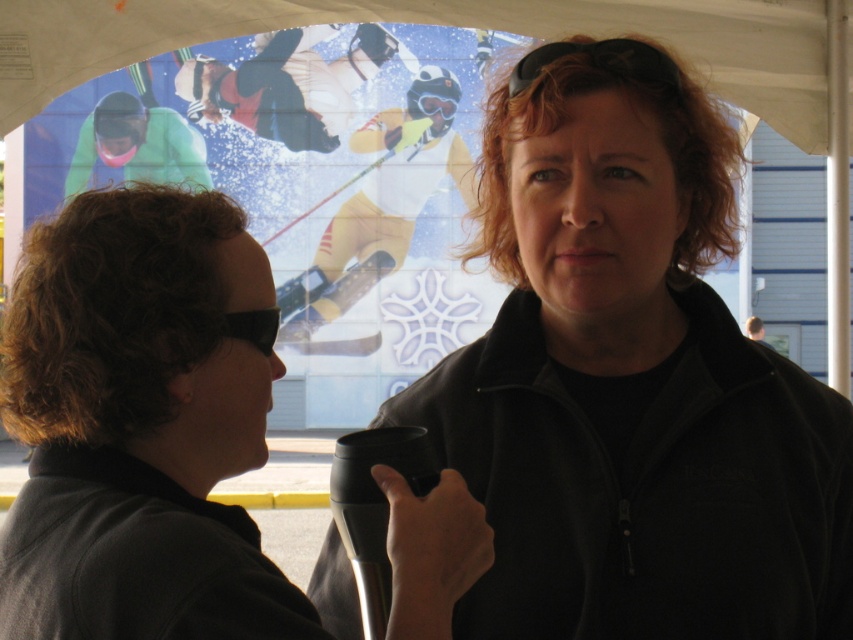
Question: Is black matte jacket at center positioned in front of green fabric jacket at upper left?

Choices:
 (A) yes
 (B) no

Answer: (A)

Question: Among these points, which one is nearest to the camera?

Choices:
 (A) (473, 182)
 (B) (149, 108)
 (C) (271, 45)

Answer: (A)

Question: Can you confirm if yellow snowsuit at center is wider than black matte sunglasses at upper center?

Choices:
 (A) yes
 (B) no

Answer: (A)

Question: Which of the following is the farthest from the observer?

Choices:
 (A) black matte jacket at center
 (B) black plastic goggles at upper left
 (C) green fabric jacket at upper left

Answer: (C)

Question: Is matte black mug at center smaller than green fabric jacket at upper left?

Choices:
 (A) no
 (B) yes

Answer: (A)

Question: Which point is farther to the camera?

Choices:
 (A) black matte sunglasses at upper center
 (B) green fabric jacket at upper left

Answer: (B)